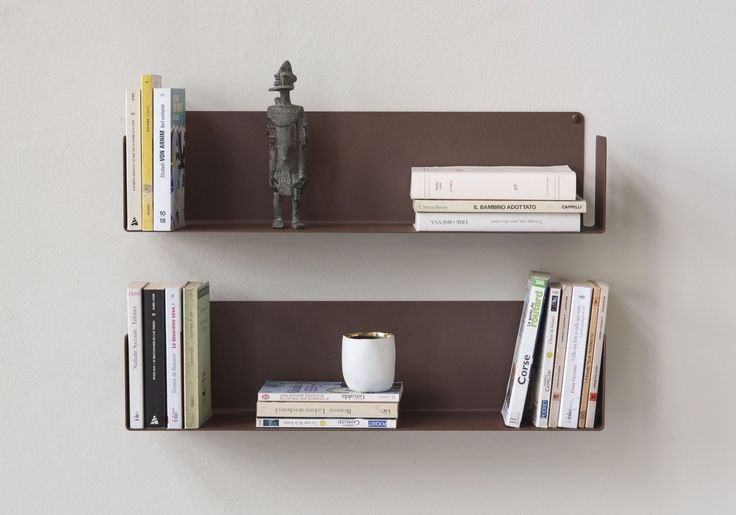
Where is `shelf end`? Image resolution: width=736 pixels, height=515 pixels. shelf end is located at coordinates (127, 379), (605, 389), (600, 207), (124, 150).